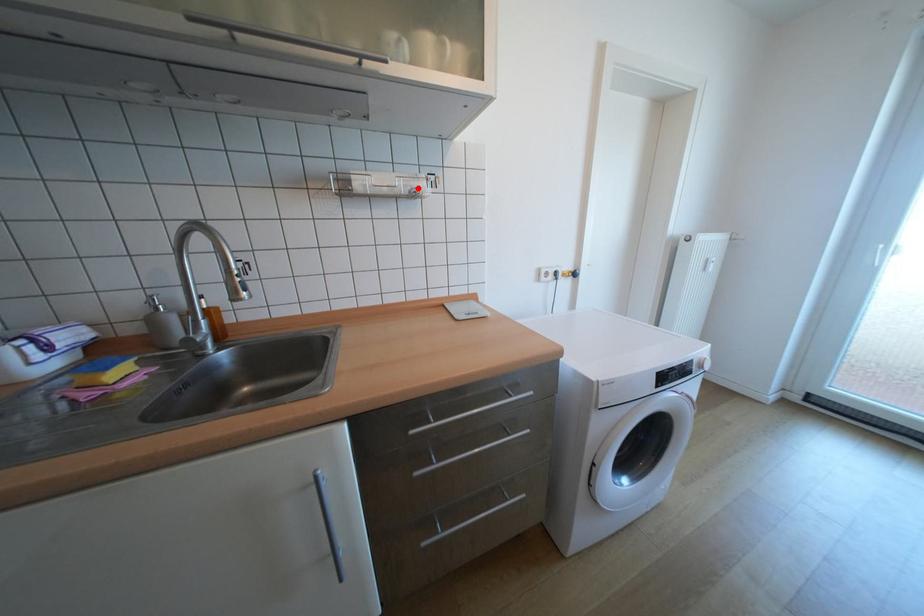
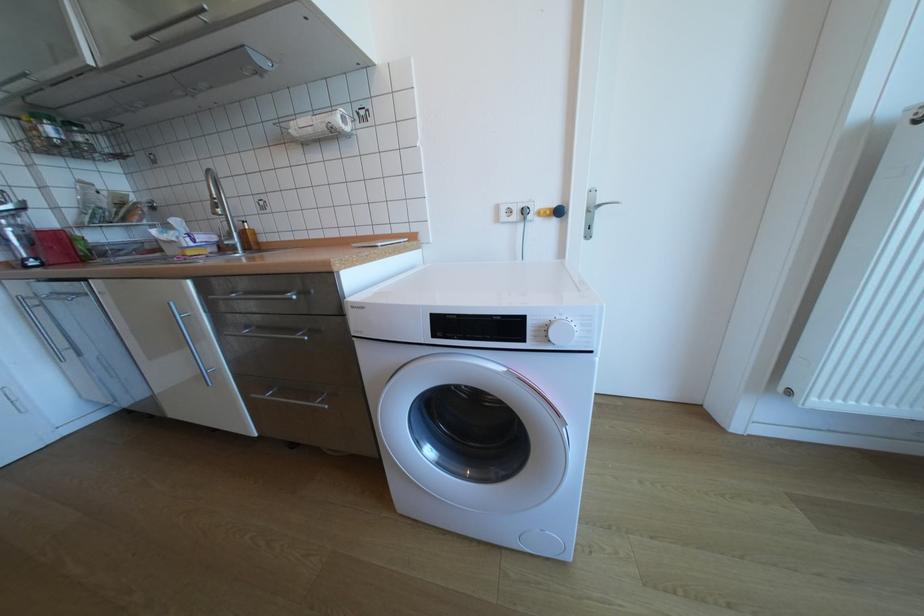
The point at the highlighted location is marked in the first image. Where is the corresponding point in the second image?

(334, 124)